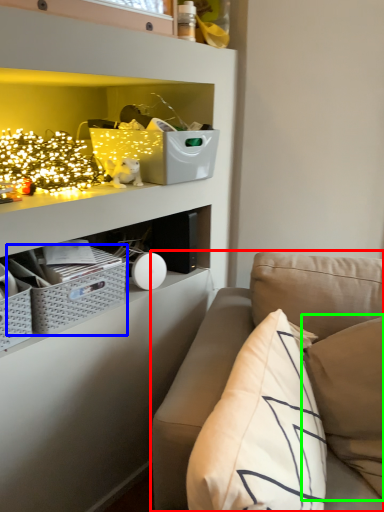
Question: Estimate the real-world distances between objects in this image. Which object is farther from studio couch (highlighted by a red box), crate (highlighted by a blue box) or pillow (highlighted by a green box)?

Choices:
 (A) crate
 (B) pillow

Answer: (A)